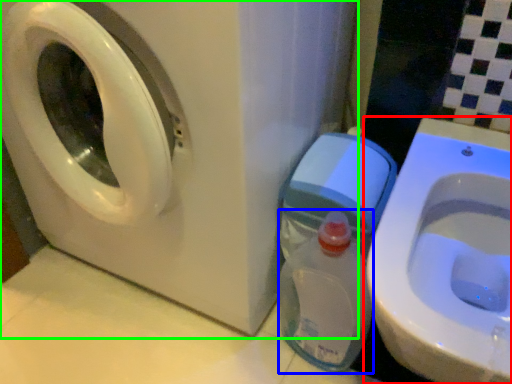
Question: Which is nearer to the toilet (highlighted by a red box)? baby bottle (highlighted by a blue box) or washing machine (highlighted by a green box).

Choices:
 (A) baby bottle
 (B) washing machine

Answer: (A)